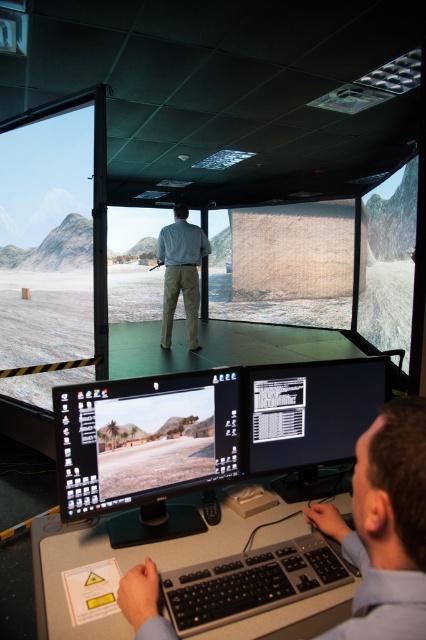
You are a trainee in the simulation room and need to locate the black glossy monitor at center. According to the coordinates provided, where exactly should you look in the image?

The black glossy monitor at center is located at the 2D coordinates point (310,420) in the image.

You are a trainee in the simulation room. You need to adjust the height of the black glossy monitor at center so it matches the height of the matte glass projection screen at right. What should you do?

The black glossy monitor at center is currently shorter than the matte glass projection screen at right. To match their heights, you should raise the black glossy monitor at center until it reaches the same level as the matte glass projection screen at right.